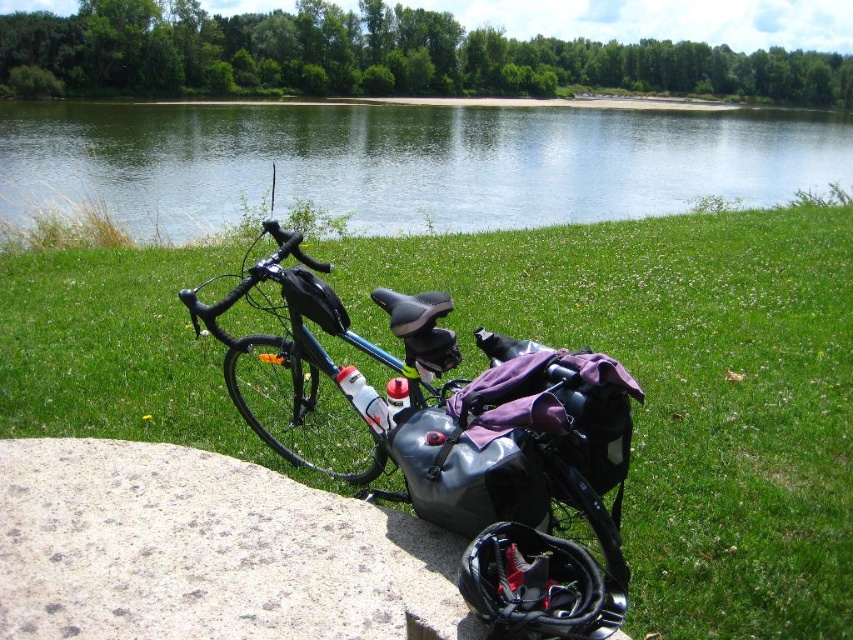
Consider the image. Can you confirm if clear water at lake center is positioned to the left of gray speckled stone at lower left?

No, clear water at lake center is not to the left of gray speckled stone at lower left.

Which is in front, point (677, 179) or point (401, 608)?

Point (401, 608) is in front.

The image size is (853, 640). I want to click on clear water at lake center, so click(x=405, y=163).

Which is in front, point (749, 154) or point (450, 525)?

Point (450, 525) is more forward.

Does clear water at lake center appear on the right side of matte black bag at center?

Correct, you'll find clear water at lake center to the right of matte black bag at center.

What do you see at coordinates (405, 163) in the screenshot?
I see `clear water at lake center` at bounding box center [405, 163].

The image size is (853, 640). In order to click on clear water at lake center in this screenshot , I will do `click(405, 163)`.

Is point (753, 428) positioned behind point (456, 452)?

Yes, point (753, 428) is farther from viewer.

Does green grass at center have a smaller size compared to matte black bag at center?

Actually, green grass at center might be larger than matte black bag at center.

Where is `green grass at center`? Image resolution: width=853 pixels, height=640 pixels. green grass at center is located at coordinates (685, 392).